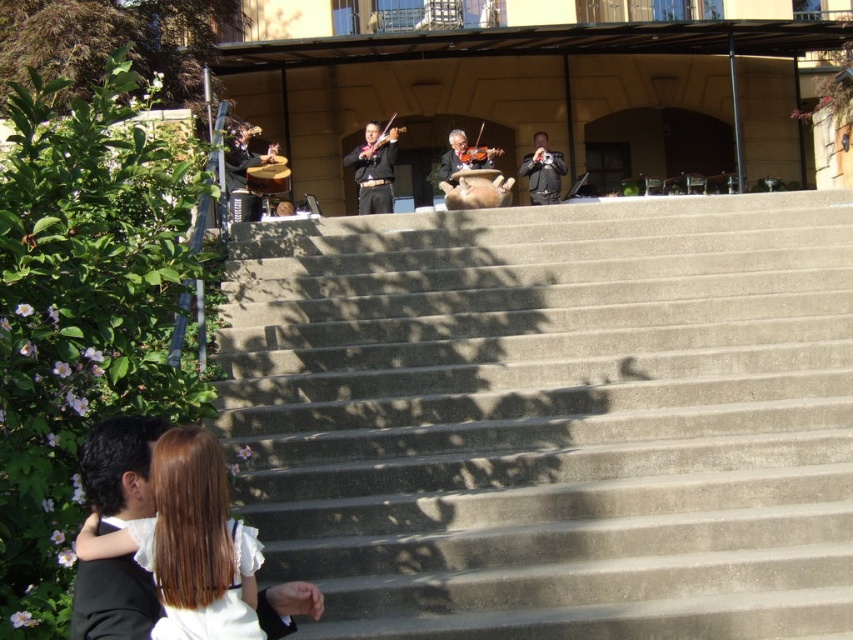
You are a stagehand setting up equipment for the outdoor performance. You need to place a tall stand that requires 1.2 meters of vertical space. Which object, the matte black drum at left or the matte black violin at center, would you avoid placing the stand in front of to ensure enough clearance?

The matte black drum at left is much taller than the matte black violin at center, so you should avoid placing the stand in front of the matte black drum at left to ensure there is enough vertical clearance.

In the scene shown: You are standing at the center of the concrete stairs where the musicians are performing. You want to place a new matte black drum at left at the exact location of point (242, 170). Is this point within the area where the musicians are currently positioned?

The point (242, 170) corresponds to the matte black drum at left, which is already occupied by the drum. Therefore, placing another matte black drum at left there would overlap with the existing one.